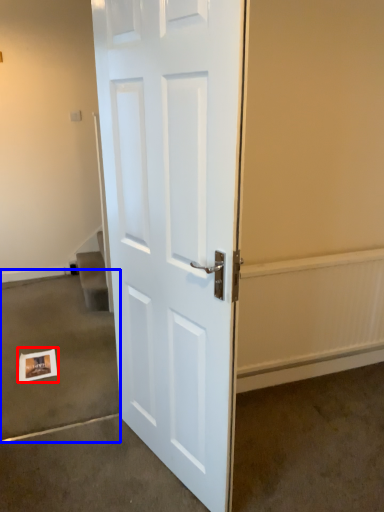
Question: Among these objects, which one is farthest to the camera, postcard (highlighted by a red box) or concrete (highlighted by a blue box)?

Choices:
 (A) postcard
 (B) concrete

Answer: (A)